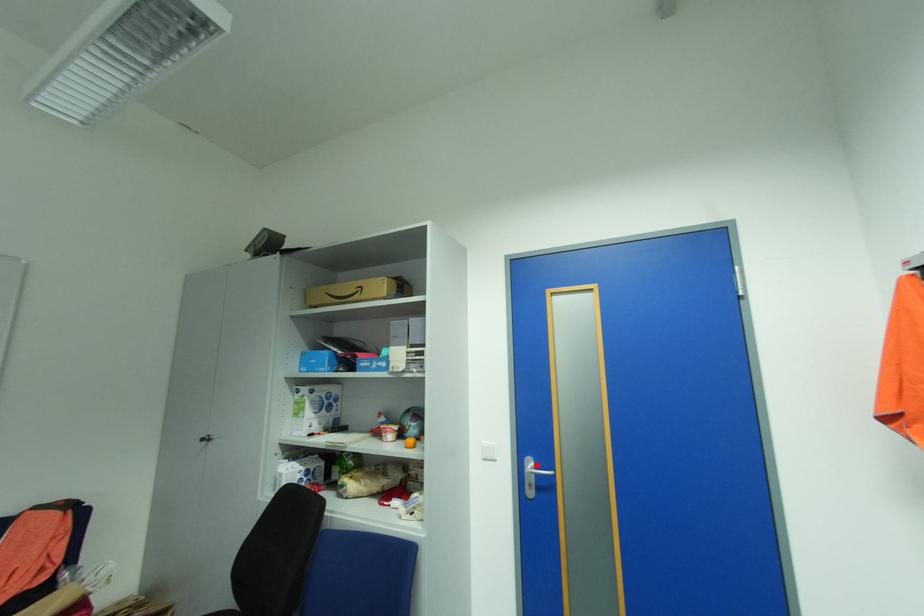
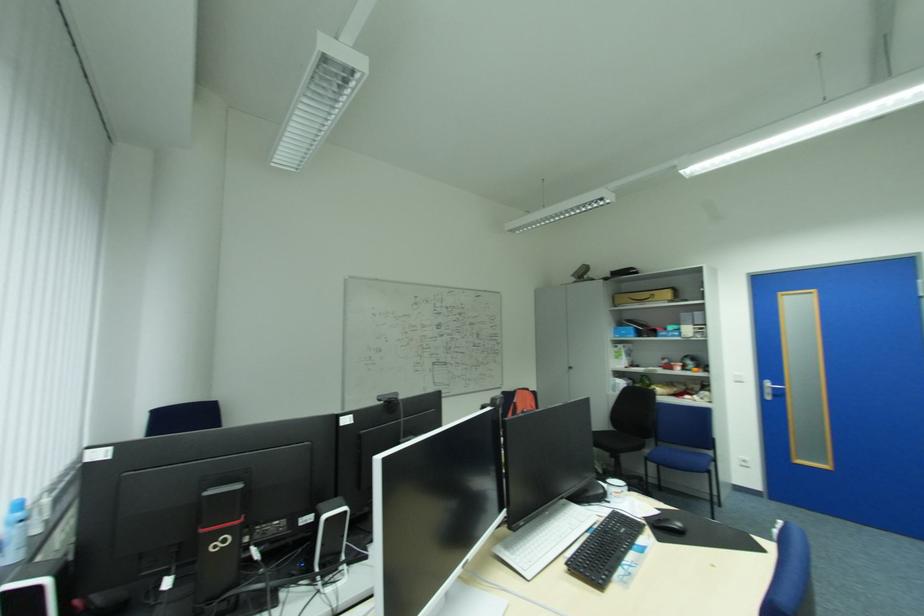
The point at the highlighted location is marked in the first image. Where is the corresponding point in the second image?

(774, 384)